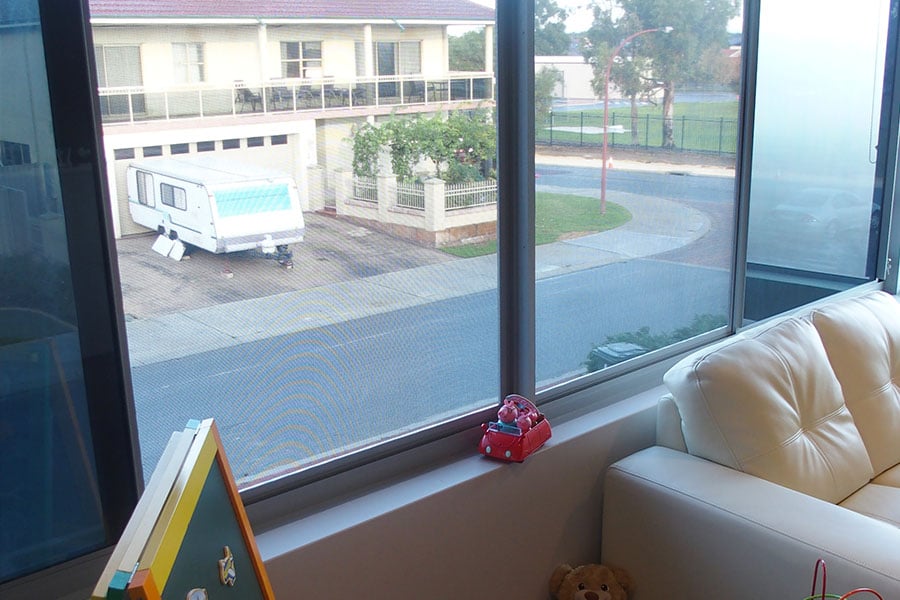
Find the location of a particular element. This screenshot has height=600, width=900. trashcan is located at coordinates (607, 347).